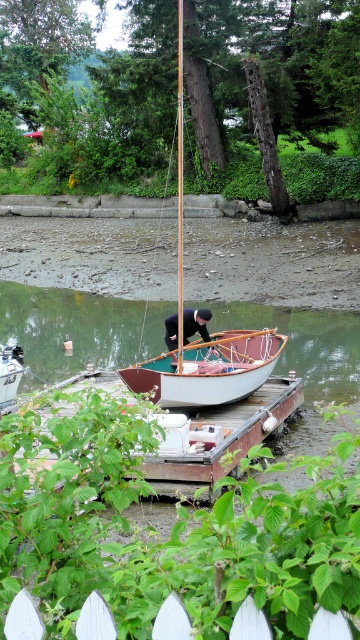
You are standing at the edge of the lake and want to board the wooden dock at center. Based on its position, is the dock closer to the water or the trees?

The wooden dock at center is located at point (219, 438), which places it closer to the water than the trees, so you can board it easily from the lake side.

You are standing on the wooden dock at center and want to board the white wood boat at center. Based on the height difference between them, what action would you need to take to safely step onto the boat?

Since the wooden dock at center is taller than the white wood boat at center, you would need to step down carefully to avoid tripping when moving from the dock to the boat.